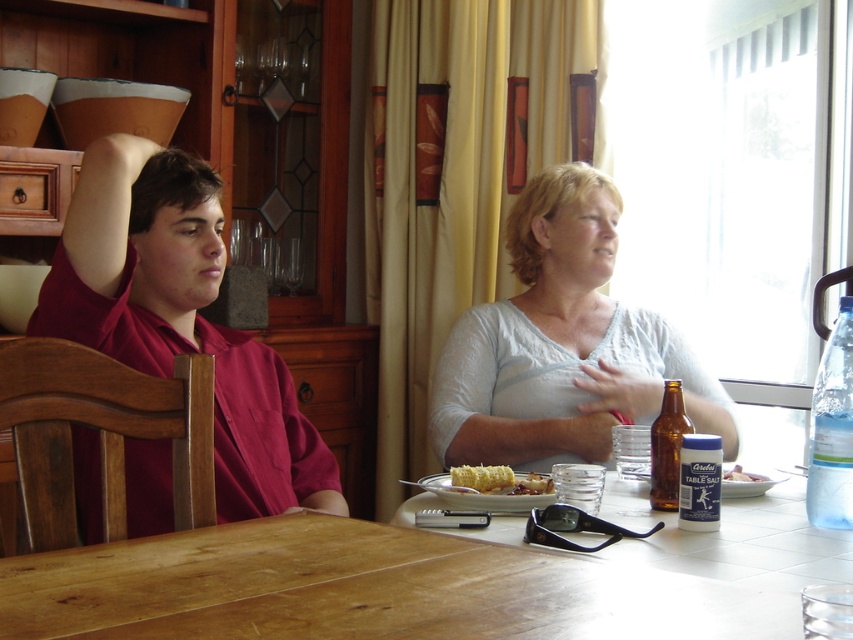
You are a food delivery person who just arrived at the dining table. You need to place a new order of a large pizza on the table. Considering the current items on the table, which object should you move to make space for the pizza? Please choose between the yellow matte corn at center and the yellow cake at center.

The yellow matte corn at center is larger than the yellow cake at center, so you should move the yellow cake at center to make space for the pizza.

You are at a restaurant table and see both the yellow matte corn at center and the yellow cake at center. Which one is positioned more to the left side of the table?

The yellow matte corn at center is positioned more to the left side of the table than the yellow cake at center.